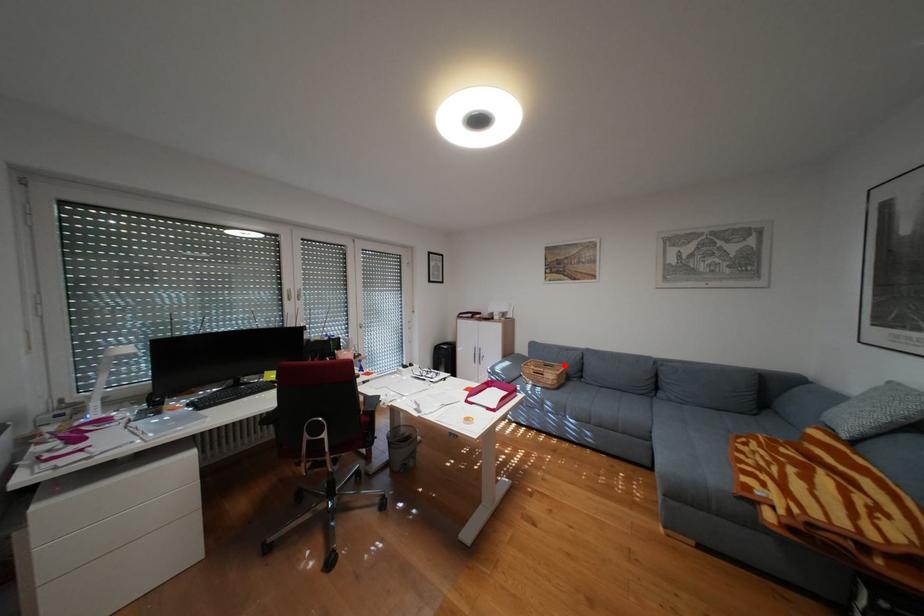
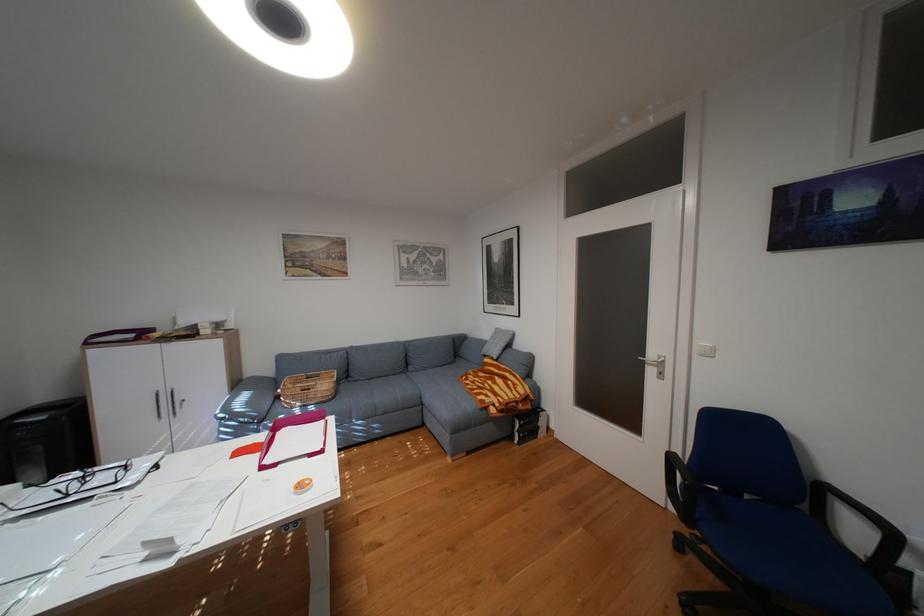
The point at the highlighted location is marked in the first image. Where is the corresponding point in the second image?

(331, 375)